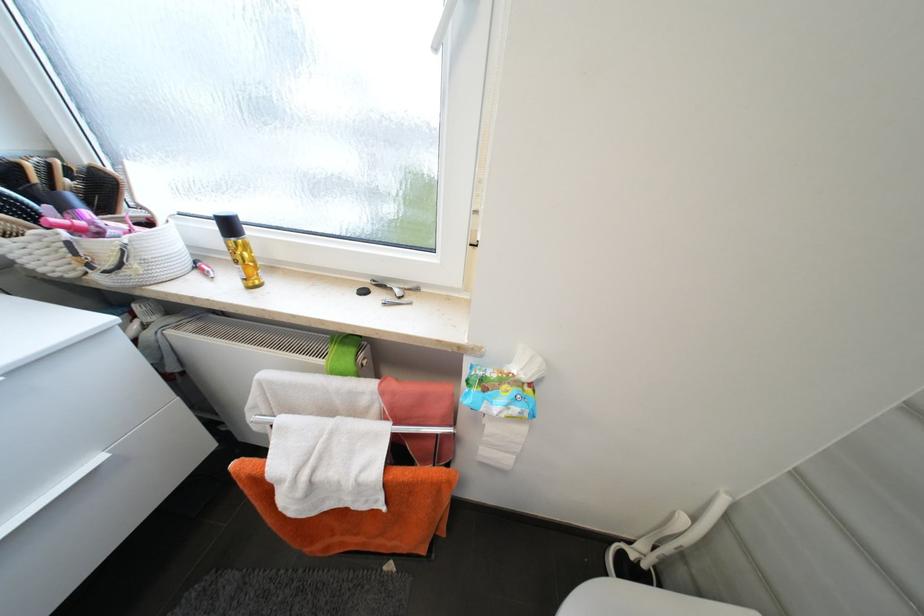
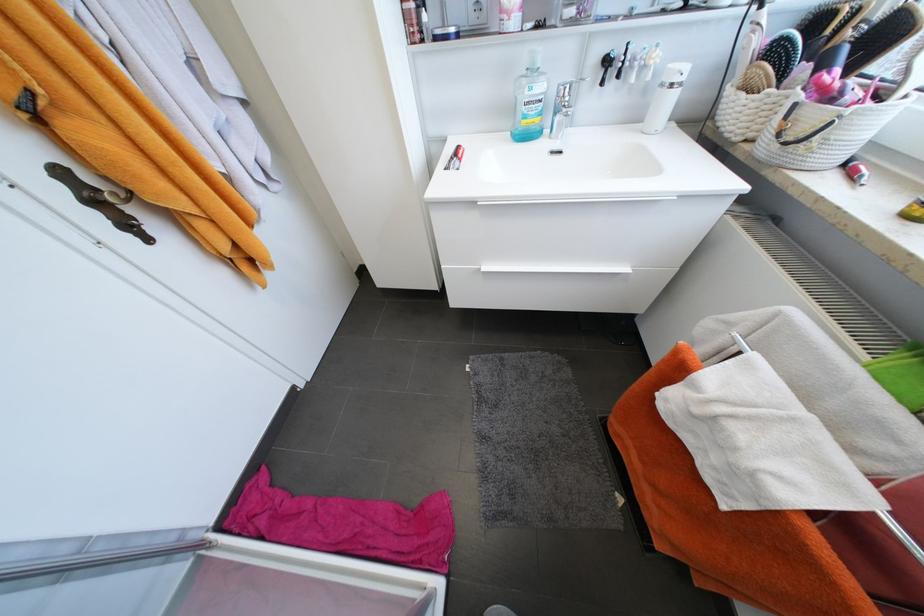
The point at (104, 460) is marked in the first image. Where is the corresponding point in the second image?

(631, 270)